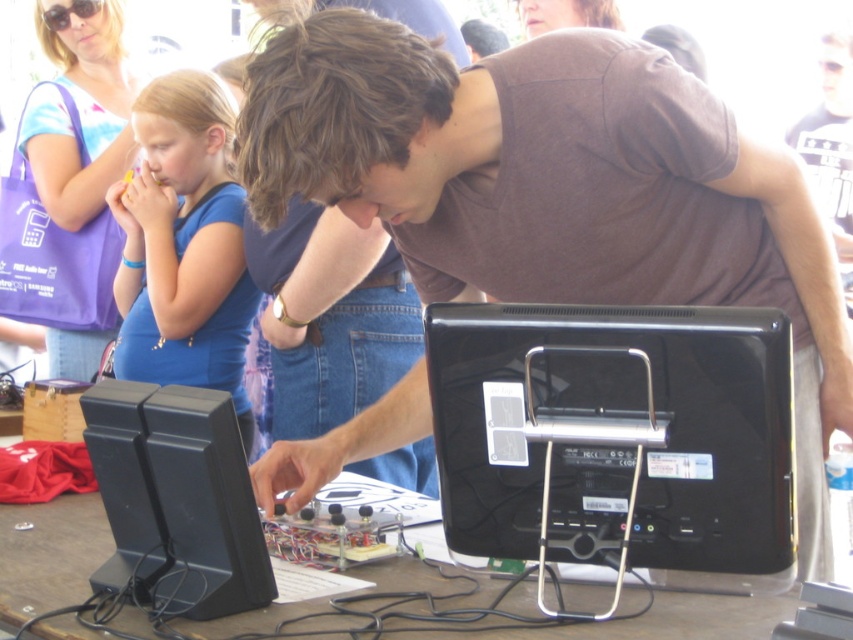
Can you confirm if matte brown shirt at center is positioned below blue fabric shirt at upper left?

Yes, matte brown shirt at center is below blue fabric shirt at upper left.

Locate an element on the screen. The width and height of the screenshot is (853, 640). matte brown shirt at center is located at coordinates (556, 189).

Locate an element on the screen. The image size is (853, 640). matte brown shirt at center is located at coordinates (556, 189).

Is point (471, 273) closer to camera compared to point (79, 557)?

No, (471, 273) is behind (79, 557).

Between point (463, 208) and point (548, 634), which one is positioned behind?

The point (463, 208) is more distant.

Where is `matte brown shirt at center`? matte brown shirt at center is located at coordinates (556, 189).

Is point (125, 364) farther from viewer compared to point (97, 44)?

No, it is in front of (97, 44).

Locate an element on the screen. The image size is (853, 640). blue fabric shirt at upper left is located at coordinates (184, 244).

Does point (235, 403) come farther from viewer compared to point (142, 80)?

No, (235, 403) is in front of (142, 80).

Find the location of a particular element. This screenshot has width=853, height=640. blue fabric shirt at upper left is located at coordinates (184, 244).